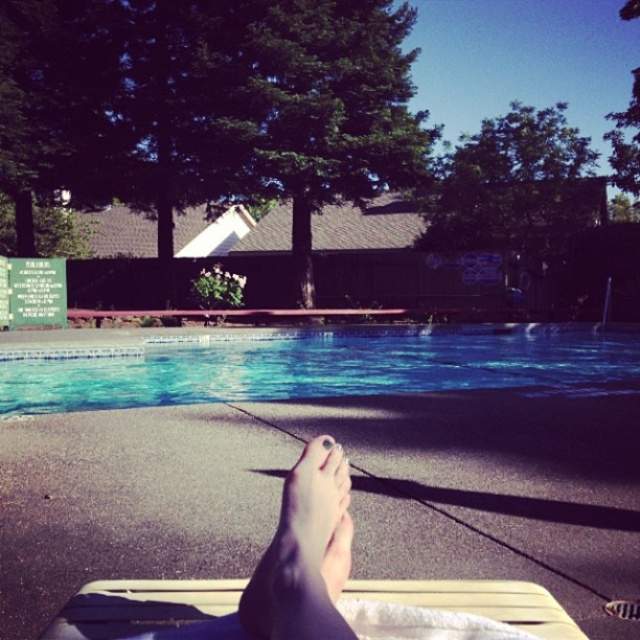
Question: Among these points, which one is nearest to the camera?

Choices:
 (A) (x=64, y=634)
 (B) (x=323, y=564)
 (C) (x=589, y=394)
 (D) (x=328, y=436)

Answer: (B)

Question: Is pale skin at center to the left of matte skin toe at center from the viewer's perspective?

Choices:
 (A) no
 (B) yes

Answer: (B)

Question: From the image, what is the correct spatial relationship of clear blue water at center in relation to wooden bench at lower center?

Choices:
 (A) above
 (B) below

Answer: (B)

Question: Which point is farther to the camera?

Choices:
 (A) (561, 326)
 (B) (321, 442)

Answer: (A)

Question: Does clear blue water at center have a smaller size compared to pale skin at center?

Choices:
 (A) no
 (B) yes

Answer: (A)

Question: Which of these objects is positioned closest to the matte skin toe at center?

Choices:
 (A) wooden bench at lower center
 (B) clear blue water at center
 (C) pale skin at center

Answer: (C)